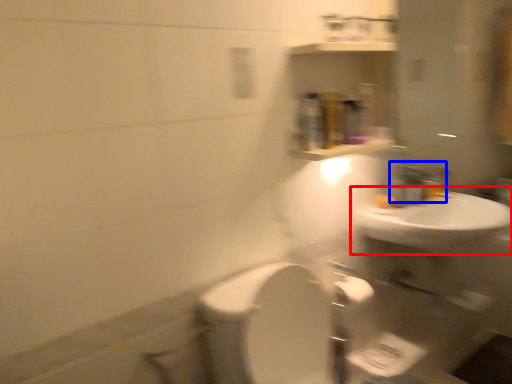
Question: Which point is closer to the camera, sink (highlighted by a red box) or faucet (highlighted by a blue box)?

Choices:
 (A) sink
 (B) faucet

Answer: (A)